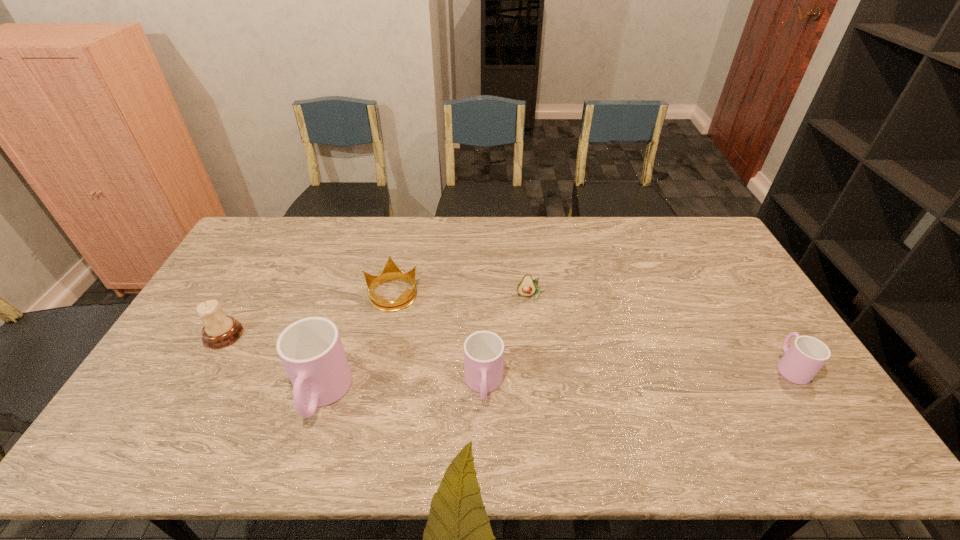
The width and height of the screenshot is (960, 540). What are the coordinates of `the tallest cup` in the screenshot? It's located at (311, 350).

This screenshot has height=540, width=960. Identify the location of the leftmost cup. (311, 350).

Where is `the second tallest cup`? The height and width of the screenshot is (540, 960). the second tallest cup is located at coordinates (483, 350).

Where is `the second cup from right to left`? The image size is (960, 540). the second cup from right to left is located at coordinates (483, 350).

The height and width of the screenshot is (540, 960). Find the location of `the rightmost cup`. the rightmost cup is located at coordinates (805, 357).

What are the coordinates of `the rightmost object` in the screenshot? It's located at (805, 357).

You are a GUI agent. You are given a task and a screenshot of the screen. Output one action in this format:
    pyautogui.click(x=<x>, y=<y>)
    Task: Click on the leftmost object
    This screenshot has width=960, height=540.
    Given the screenshot: What is the action you would take?
    pyautogui.click(x=219, y=331)

Locate an element on the screen. This screenshot has width=960, height=540. avocado is located at coordinates (527, 287).

Locate an element on the screen. crown is located at coordinates (391, 271).

The height and width of the screenshot is (540, 960). I want to click on free space located 0.080m with the handle on the side of the shortest cup, so click(765, 328).